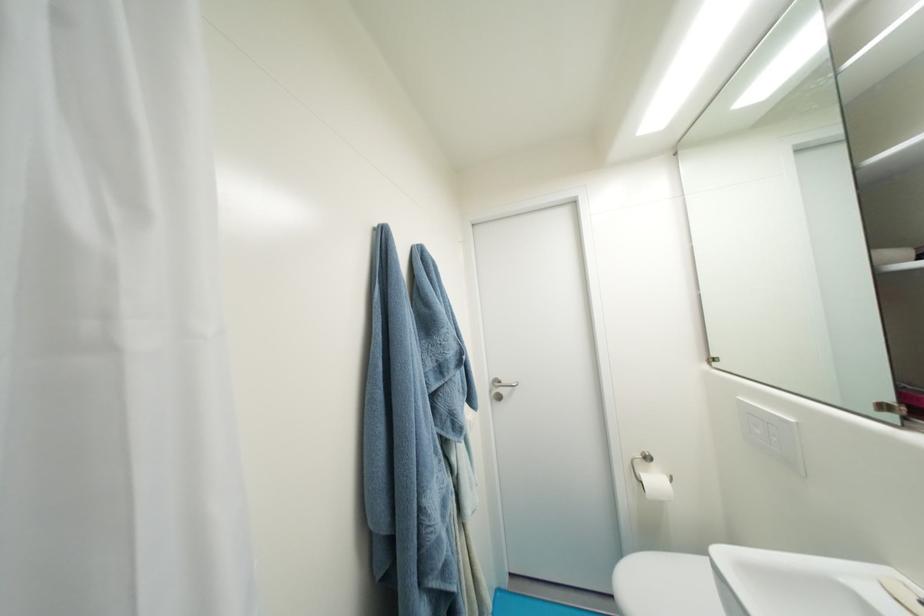
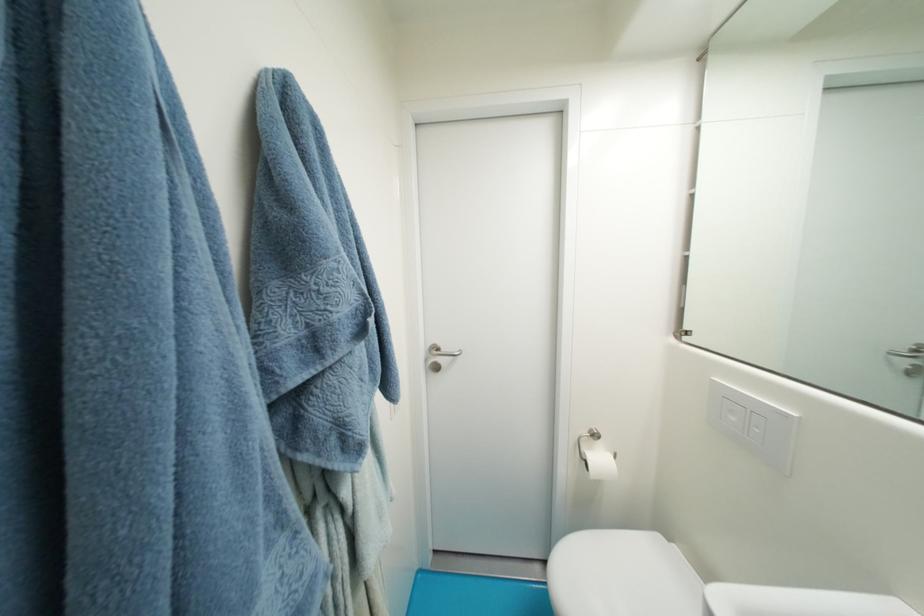
Question: The camera is either moving clockwise (left) or counter-clockwise (right) around the object. The first image is from the beginning of the video and the second image is from the end. Is the camera moving left or right when shooting the video?

Choices:
 (A) Left
 (B) Right

Answer: (A)